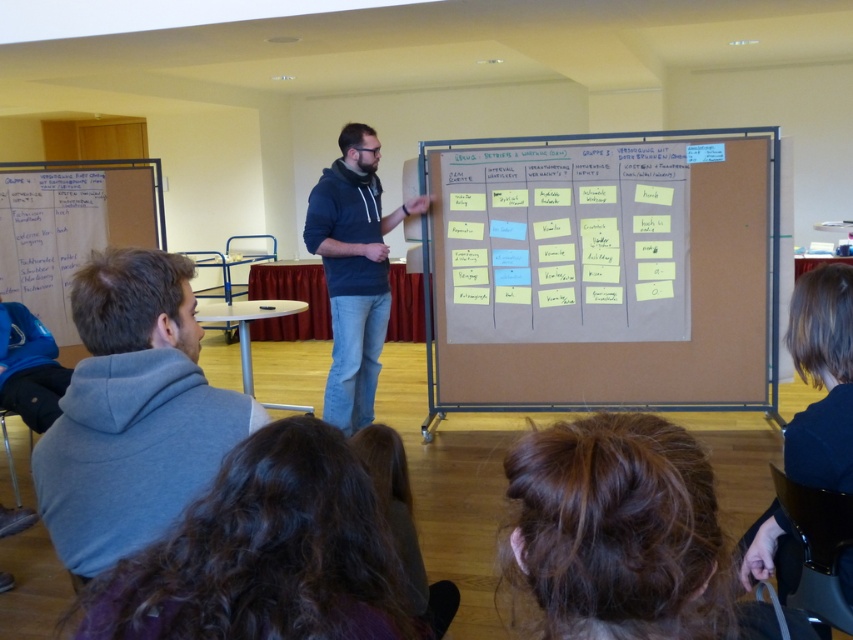
In the scene shown: You are a participant in the meeting and need to point out something on the board. Which of the two points, point (369,362) or point (763,513), is closer to you?

Point (763,513) is closer to you because it is less further to the camera than point (369,362).